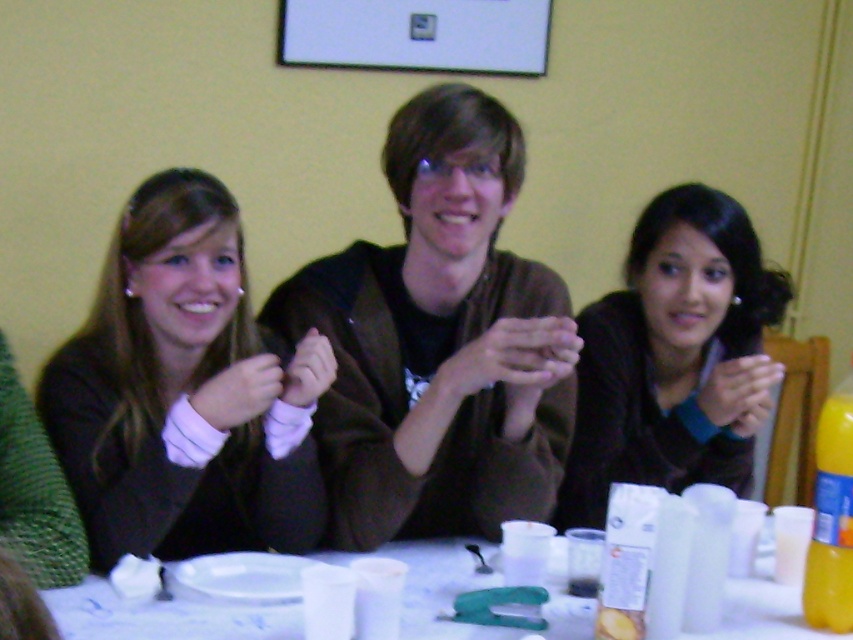
Question: Which point appears closest to the camera in this image?

Choices:
 (A) (154, 612)
 (B) (572, 515)

Answer: (A)

Question: Can you confirm if matte black sweater at left is positioned to the right of white plastic table at lower center?

Choices:
 (A) yes
 (B) no

Answer: (B)

Question: Which of the following is the farthest from the observer?

Choices:
 (A) (181, 310)
 (B) (466, 275)
 (C) (688, 285)

Answer: (C)

Question: Observing the image, what is the correct spatial positioning of brown fuzzy sweater at center in reference to white plastic table at lower center?

Choices:
 (A) right
 (B) left

Answer: (B)

Question: Considering the real-world distances, which object is closest to the matte black sweater at left?

Choices:
 (A) dark brown sweater at center
 (B) white plastic table at lower center
 (C) brown fuzzy sweater at center

Answer: (C)

Question: In this image, where is matte black sweater at left located relative to dark brown sweater at center?

Choices:
 (A) above
 (B) below

Answer: (A)